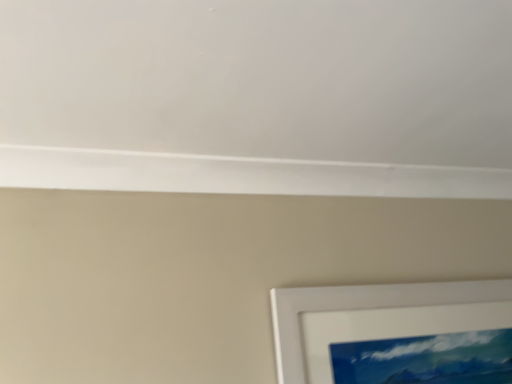
What do you see at coordinates (362, 308) in the screenshot?
I see `white matte picture frame at lower right` at bounding box center [362, 308].

Locate an element on the screen. Image resolution: width=512 pixels, height=384 pixels. white matte picture frame at lower right is located at coordinates (362, 308).

At what (x,y) coordinates should I click in order to perform the action: click on white matte picture frame at lower right. Please return your answer as a coordinate pair (x, y). This screenshot has width=512, height=384. Looking at the image, I should click on (362, 308).